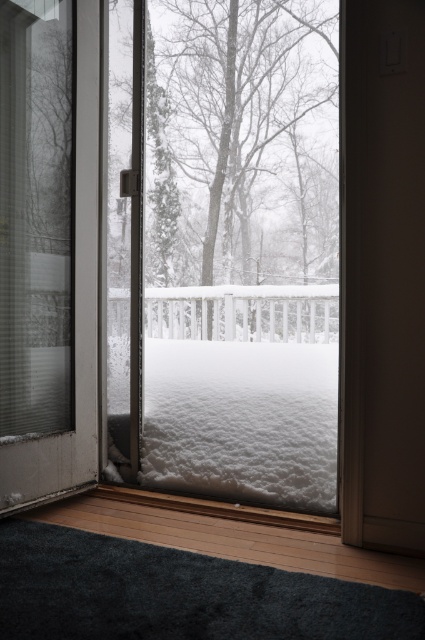
Question: Among these points, which one is farthest from the camera?

Choices:
 (A) (391, 212)
 (B) (235, 312)
 (C) (232, 419)

Answer: (B)

Question: Does white fluffy snow at center have a larger size compared to white wooden rail at center?

Choices:
 (A) no
 (B) yes

Answer: (A)

Question: Is brown matte door at center closer to camera compared to white fluffy snow at center?

Choices:
 (A) no
 (B) yes

Answer: (B)

Question: Is transparent glass window at center thinner than white wooden rail at center?

Choices:
 (A) yes
 (B) no

Answer: (A)

Question: Which of the following is the farthest from the observer?

Choices:
 (A) brown matte door at center
 (B) white fluffy snow at center

Answer: (B)

Question: Which object is the farthest from the white wooden rail at center?

Choices:
 (A) transparent glass window at center
 (B) brown matte door at center
 (C) white fluffy snow at center

Answer: (B)